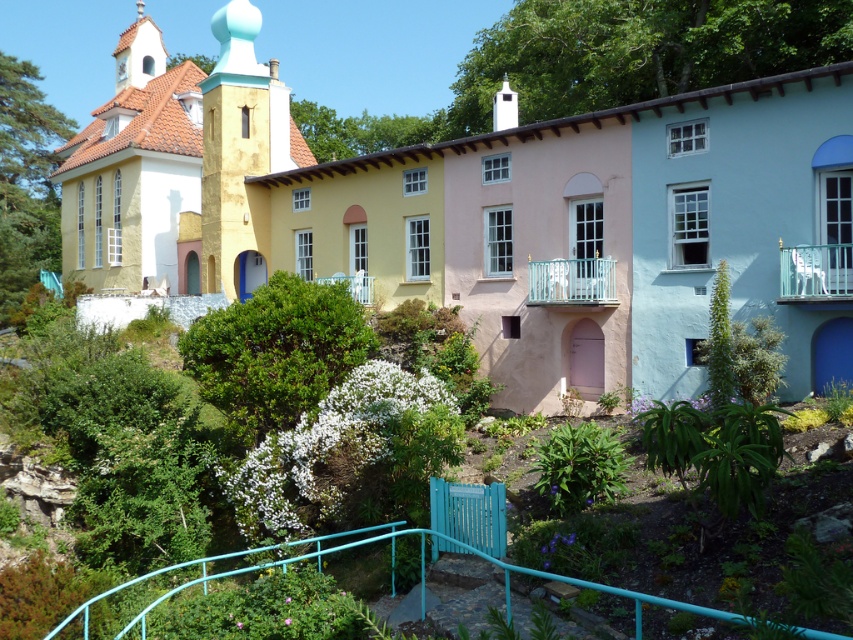
Question: In this image, where is matte yellow church at upper left located relative to white stucco spire at upper left?

Choices:
 (A) above
 (B) below

Answer: (B)

Question: Does matte yellow church at upper left come behind white stucco spire at upper left?

Choices:
 (A) no
 (B) yes

Answer: (A)

Question: Which of the following is the farthest from the observer?

Choices:
 (A) matte yellow chapel at upper left
 (B) matte yellow church at upper left
 (C) white stucco spire at upper left
 (D) teal metal railing at lower center

Answer: (C)

Question: Which object appears closest to the camera in this image?

Choices:
 (A) white stucco spire at upper left
 (B) matte yellow chapel at upper left
 (C) matte yellow church at upper left
 (D) teal metal railing at lower center

Answer: (D)

Question: Is teal metal railing at lower center smaller than white stucco spire at upper left?

Choices:
 (A) yes
 (B) no

Answer: (A)

Question: Which point appears closest to the camera in this image?

Choices:
 (A) (439, 538)
 (B) (149, 52)

Answer: (A)